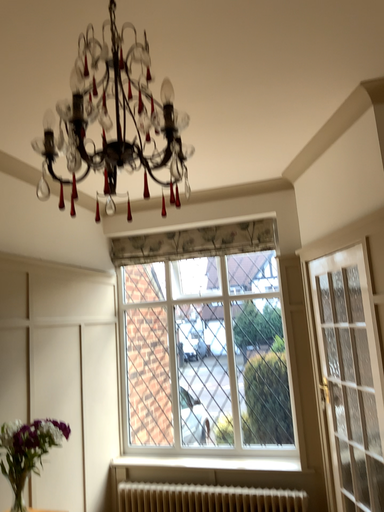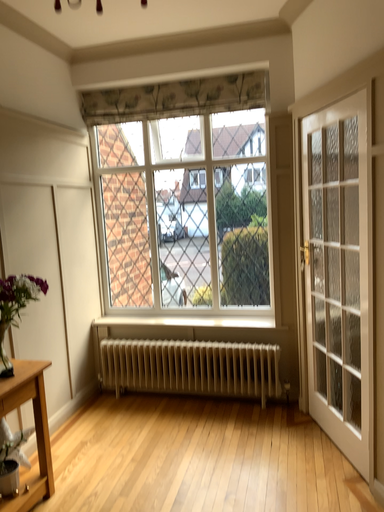
Question: Which way did the camera rotate in the video?

Choices:
 (A) rotated upward
 (B) rotated downward

Answer: (B)